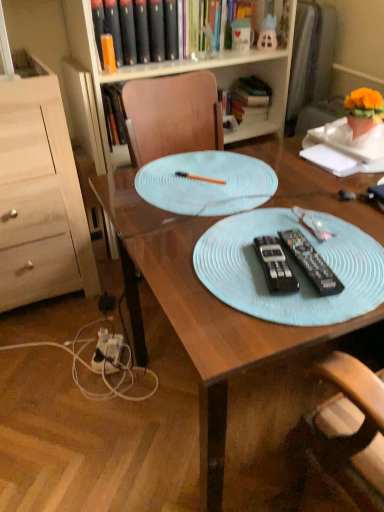
Question: Does light blue plastic placemat at center have a greater height compared to orange plastic pen at center?

Choices:
 (A) yes
 (B) no

Answer: (A)

Question: Is orange plastic pen at center at the back of light blue plastic placemat at center?

Choices:
 (A) no
 (B) yes

Answer: (A)

Question: From a real-world perspective, is light blue plastic placemat at center on orange plastic pen at center?

Choices:
 (A) yes
 (B) no

Answer: (B)

Question: Considering the relative positions of light blue plastic placemat at center and orange plastic pen at center in the image provided, is light blue plastic placemat at center behind orange plastic pen at center?

Choices:
 (A) no
 (B) yes

Answer: (A)

Question: Is the depth of light blue plastic placemat at center less than that of orange plastic pen at center?

Choices:
 (A) no
 (B) yes

Answer: (B)

Question: Is light blue plastic placemat at center positioned beyond the bounds of orange plastic pen at center?

Choices:
 (A) yes
 (B) no

Answer: (A)

Question: Does light wood dresser at left have a greater height compared to light blue fabric placemat at center?

Choices:
 (A) no
 (B) yes

Answer: (B)

Question: From the image's perspective, is light wood dresser at left beneath light blue fabric placemat at center?

Choices:
 (A) yes
 (B) no

Answer: (B)

Question: Is light wood dresser at left thinner than light blue fabric placemat at center?

Choices:
 (A) yes
 (B) no

Answer: (B)

Question: Does light wood dresser at left appear on the right side of light blue fabric placemat at center?

Choices:
 (A) yes
 (B) no

Answer: (B)

Question: Does light wood dresser at left have a larger size compared to light blue fabric placemat at center?

Choices:
 (A) yes
 (B) no

Answer: (A)

Question: Considering the relative positions of light wood dresser at left and light blue fabric placemat at center in the image provided, is light wood dresser at left to the left of light blue fabric placemat at center from the viewer's perspective?

Choices:
 (A) yes
 (B) no

Answer: (A)

Question: From the image's perspective, is white plastic power outlet at lower left located beneath black plastic remote control at center, which appears as the 1th remote control when viewed from the left?

Choices:
 (A) no
 (B) yes

Answer: (B)